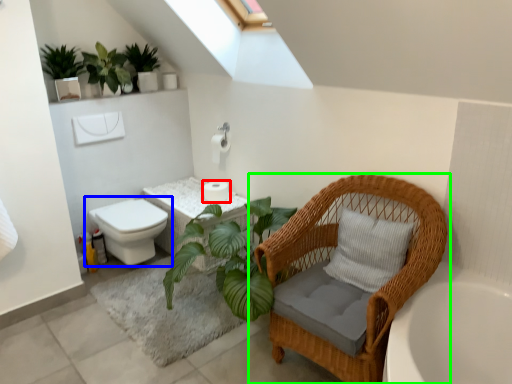
Question: Which is farther away from toilet paper (highlighted by a red box)? toilet (highlighted by a blue box) or chair (highlighted by a green box)?

Choices:
 (A) toilet
 (B) chair

Answer: (B)